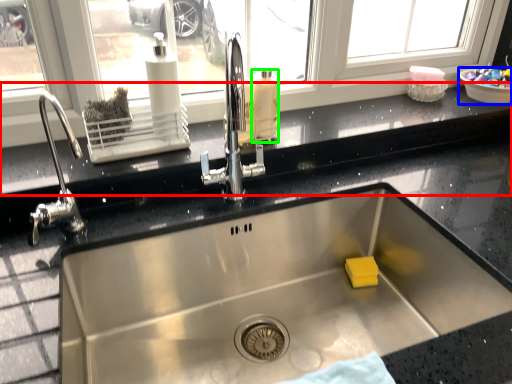
Question: Which object is the closest to the window sill (highlighted by a red box)? Choose among these: basin (highlighted by a blue box) or cleaning product (highlighted by a green box).

Choices:
 (A) basin
 (B) cleaning product

Answer: (B)